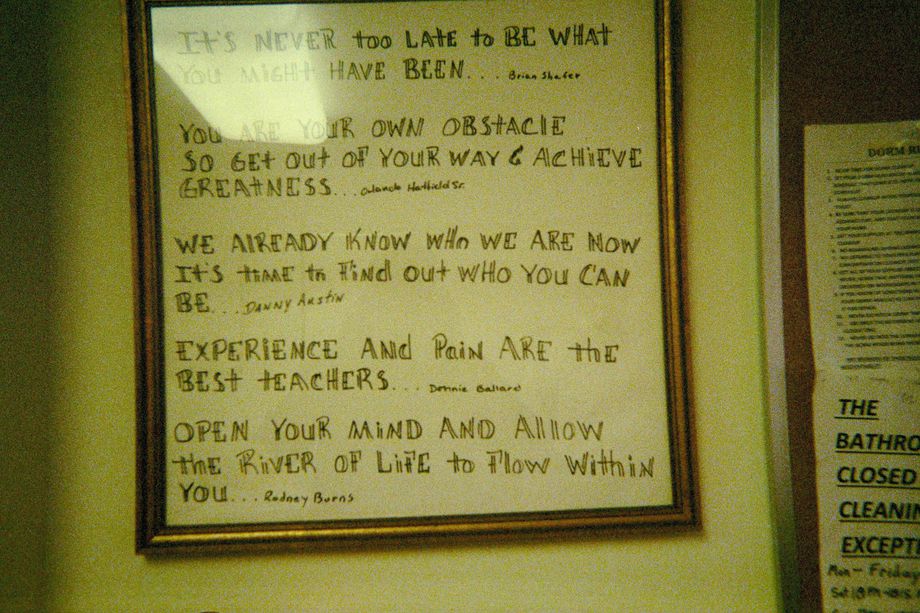
Find the location of a particular element. This screenshot has width=920, height=613. picture frame is located at coordinates (669, 132), (628, 524), (154, 436), (145, 324), (669, 194).